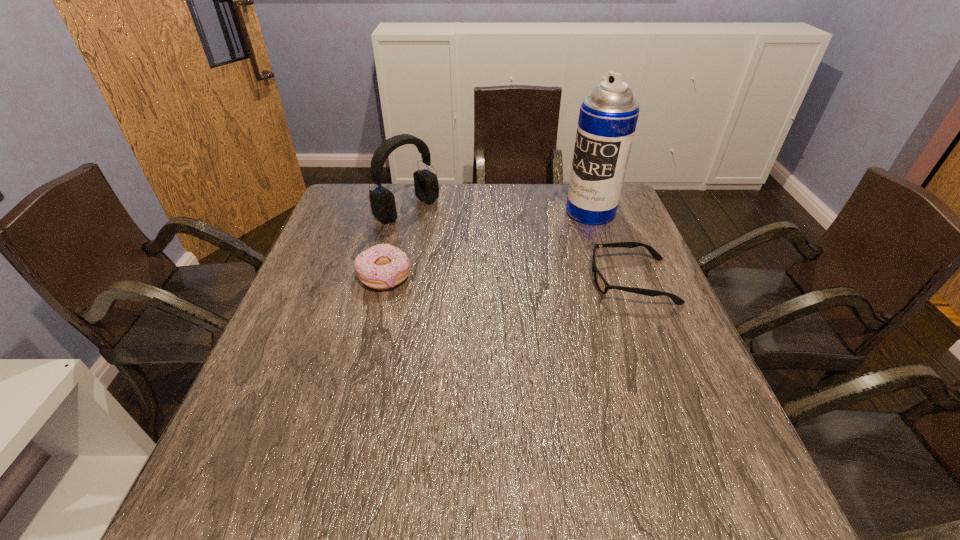
Locate an element on the screen. The width and height of the screenshot is (960, 540). vacant space that satisfies the following two spatial constraints: 1. on the front side of the spectacles; 2. on the front-facing side of the second tallest object is located at coordinates (391, 281).

Where is `vacant space that satisfies the following two spatial constraints: 1. on the back side of the third tallest object; 2. on the left side of the third shortest object`? This screenshot has width=960, height=540. vacant space that satisfies the following two spatial constraints: 1. on the back side of the third tallest object; 2. on the left side of the third shortest object is located at coordinates (401, 209).

Where is `free space that satisfies the following two spatial constraints: 1. on the front side of the second tallest object; 2. on the front-facing side of the spectacles`? This screenshot has height=540, width=960. free space that satisfies the following two spatial constraints: 1. on the front side of the second tallest object; 2. on the front-facing side of the spectacles is located at coordinates (391, 281).